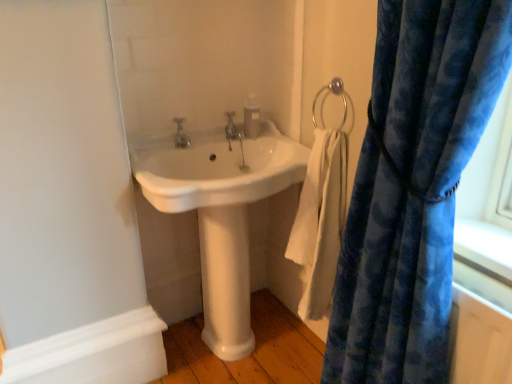
Locate an element on the screen. velvety blue curtain at right is located at coordinates (413, 187).

Locate an element on the screen. matte silver faucet at center, which is the second tap from right to left is located at coordinates (181, 134).

Image resolution: width=512 pixels, height=384 pixels. Describe the element at coordinates (320, 221) in the screenshot. I see `white cotton towel at lower right` at that location.

This screenshot has height=384, width=512. Describe the element at coordinates (335, 95) in the screenshot. I see `silver metallic towel ring at upper right` at that location.

Find the location of a particular element. This screenshot has height=384, width=512. polished chrome faucet at center, acting as the first tap starting from the back is located at coordinates (231, 127).

Considering the positions of points (375, 268) and (313, 190), is point (375, 268) closer to camera compared to point (313, 190)?

Yes, point (375, 268) is closer to viewer.

From the image's perspective, is velvety blue curtain at right located above or below white cotton towel at lower right?

From the image's perspective, velvety blue curtain at right appears below white cotton towel at lower right.

Is velvety blue curtain at right far away from white cotton towel at lower right?

They are positioned close to each other.

Is velvety blue curtain at right turned away from white cotton towel at lower right?

No, white cotton towel at lower right is not at the back of velvety blue curtain at right.

Where is `pillar located below the white glossy sink at center (from the image's perspective)`? The height and width of the screenshot is (384, 512). pillar located below the white glossy sink at center (from the image's perspective) is located at coordinates (226, 281).

From the image's perspective, which is below, white glossy sink at center or white glossy pedestal at center?

From the image's view, white glossy pedestal at center is below.

How many degrees apart are the facing directions of white glossy sink at center and white glossy pedestal at center?

The angle between the facing direction of white glossy sink at center and the facing direction of white glossy pedestal at center is 0.000107 degrees.

From a real-world perspective, does white glossy sink at center stand above white glossy pedestal at center?

Correct, in the physical world, white glossy sink at center is higher than white glossy pedestal at center.

Does silver metallic towel ring at upper right have a lesser width compared to polished chrome faucet at center, the first tap from the right?

Yes, silver metallic towel ring at upper right is thinner than polished chrome faucet at center, the first tap from the right.

Does silver metallic towel ring at upper right lie in front of polished chrome faucet at center, positioned as the 2th tap in left-to-right order?

Yes.

Would you say silver metallic towel ring at upper right is a long distance from polished chrome faucet at center, arranged as the 2th tap when viewed from the front?

No, silver metallic towel ring at upper right is not far away from polished chrome faucet at center, arranged as the 2th tap when viewed from the front.

Consider the image. From the image's perspective, relative to polished chrome faucet at center, positioned as the 2th tap in left-to-right order, is silver metallic towel ring at upper right above or below?

silver metallic towel ring at upper right is situated higher than polished chrome faucet at center, positioned as the 2th tap in left-to-right order, in the image.

From the image's perspective, which object appears higher, velvety blue curtain at right or white glossy sink at center?

white glossy sink at center, from the image's perspective.

Is velvety blue curtain at right to the right of white glossy sink at center from the viewer's perspective?

Correct, you'll find velvety blue curtain at right to the right of white glossy sink at center.

Measure the distance from velvety blue curtain at right to white glossy sink at center.

The distance of velvety blue curtain at right from white glossy sink at center is 19.89 inches.

Between velvety blue curtain at right and white glossy sink at center, which one has larger width?

white glossy sink at center is wider.

The image size is (512, 384). What are the coordinates of `soap dispenser above the matte silver faucet at center, which is the first tap from front to back (from a real-world perspective)` in the screenshot? It's located at (x=251, y=116).

Based on the photo, is matte silver faucet at center, marked as the 1th tap in a left-to-right arrangement, facing towards translucent plastic soap dispenser at upper center?

No, matte silver faucet at center, marked as the 1th tap in a left-to-right arrangement, is not aimed at translucent plastic soap dispenser at upper center.

Does point (185, 143) appear closer or farther from the camera than point (245, 102)?

Clearly, point (185, 143) is closer to the camera than point (245, 102).

Which object is positioned more to the right, matte silver faucet at center, which is the second tap from right to left, or translucent plastic soap dispenser at upper center?

translucent plastic soap dispenser at upper center is more to the right.

Between white glossy pedestal at center and velvety blue curtain at right, which one has less height?

Standing shorter between the two is white glossy pedestal at center.

From a real-world perspective, is white glossy pedestal at center under velvety blue curtain at right?

Yes, from a real-world perspective, white glossy pedestal at center is below velvety blue curtain at right.

Between point (240, 353) and point (452, 163), which one is positioned behind?

Positioned behind is point (240, 353).

Based on the photo, is white glossy pedestal at center positioned with its back to white glossy sink at center?

white glossy pedestal at center is not turned away from white glossy sink at center.

Is white glossy pedestal at center outside of white glossy sink at center?

Yes.

Does point (202, 209) appear closer or farther from the camera than point (162, 142)?

Point (202, 209) is positioned farther from the camera compared to point (162, 142).

Where is `sink above the white glossy pedestal at center (from a real-world perspective)`? sink above the white glossy pedestal at center (from a real-world perspective) is located at coordinates (216, 168).

At what (x,y) coordinates should I click in order to perform the action: click on curtain above the white cotton towel at lower right (from a real-world perspective). Please return your answer as a coordinate pair (x, y). Looking at the image, I should click on (413, 187).

Locate an element on the screen. The height and width of the screenshot is (384, 512). pillar that is on the left side of white glossy sink at center is located at coordinates (226, 281).

Looking at the image, which one is located further to silver metallic towel ring at upper right, white cotton towel at lower right or white glossy pedestal at center?

The object further to silver metallic towel ring at upper right is white glossy pedestal at center.

Which object lies nearer to the anchor point white glossy pedestal at center, polished chrome faucet at center, arranged as the 2th tap when viewed from the front, or velvety blue curtain at right?

Among the two, velvety blue curtain at right is located nearer to white glossy pedestal at center.

Looking at the image, which one is located further to matte silver faucet at center, which ranks as the 2th tap in back-to-front order, white cotton towel at lower right or white glossy pedestal at center?

white cotton towel at lower right is further to matte silver faucet at center, which ranks as the 2th tap in back-to-front order.

Based on their spatial positions, is white cotton towel at lower right or white glossy sink at center further from translucent plastic soap dispenser at upper center?

Among the two, white cotton towel at lower right is located further to translucent plastic soap dispenser at upper center.

Which object lies further to the anchor point white cotton towel at lower right, white glossy sink at center or translucent plastic soap dispenser at upper center?

Among the two, translucent plastic soap dispenser at upper center is located further to white cotton towel at lower right.

From the image, which object appears to be nearer to white glossy pedestal at center, velvety blue curtain at right or polished chrome faucet at center, acting as the first tap starting from the back?

The object closer to white glossy pedestal at center is velvety blue curtain at right.

Considering their positions, is polished chrome faucet at center, acting as the first tap starting from the back, positioned closer to velvety blue curtain at right than matte silver faucet at center, marked as the 1th tap in a left-to-right arrangement?

Based on the image, polished chrome faucet at center, acting as the first tap starting from the back, appears to be nearer to velvety blue curtain at right.

Which object lies nearer to the anchor point velvety blue curtain at right, matte silver faucet at center, which is the first tap from front to back, or white cotton towel at lower right?

white cotton towel at lower right lies closer to velvety blue curtain at right than the other object.

Image resolution: width=512 pixels, height=384 pixels. I want to click on bath towel between white glossy sink at center and white glossy pedestal at center vertically, so click(x=320, y=221).

Image resolution: width=512 pixels, height=384 pixels. In order to click on tap between matte silver faucet at center, marked as the 1th tap in a left-to-right arrangement, and translucent plastic soap dispenser at upper center from left to right in this screenshot , I will do `click(231, 127)`.

Identify the location of bath towel between silver metallic towel ring at upper right and white glossy pedestal at center in the up-down direction. (320, 221).

Find the location of a particular element. Image resolution: width=512 pixels, height=384 pixels. bath towel positioned between velvety blue curtain at right and silver metallic towel ring at upper right from near to far is located at coordinates (320, 221).